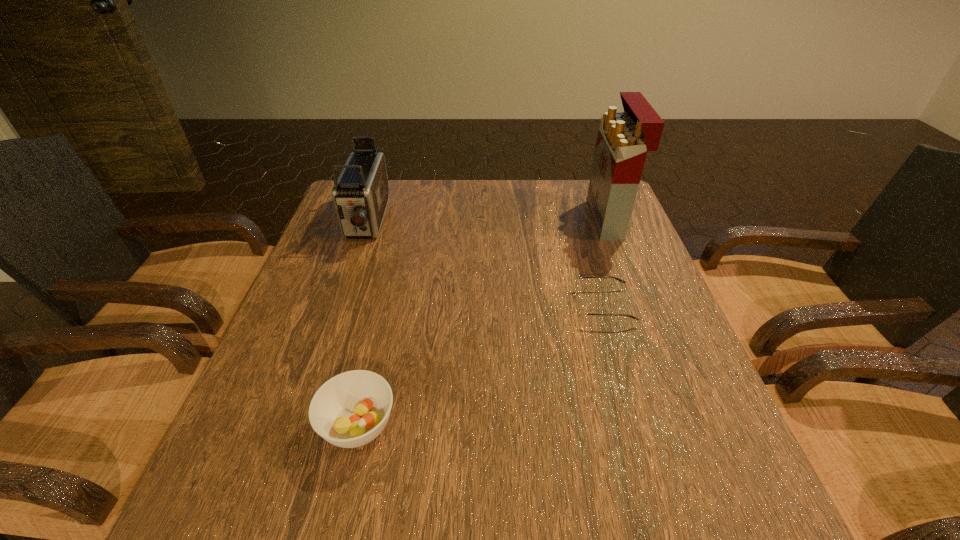
Where is `object situated at the far left corner`? This screenshot has height=540, width=960. object situated at the far left corner is located at coordinates (360, 194).

Find the location of `object positioned at the far right corner`. object positioned at the far right corner is located at coordinates (624, 138).

Find the location of a particular element. This screenshot has width=960, height=540. free space at the far edge is located at coordinates (413, 199).

Locate an element on the screen. This screenshot has height=540, width=960. free spot at the near edge of the desktop is located at coordinates (368, 506).

Locate an element on the screen. vacant space at the left edge of the desktop is located at coordinates (297, 314).

Identify the location of blank space at the right edge of the desktop. The width and height of the screenshot is (960, 540). (588, 260).

Image resolution: width=960 pixels, height=540 pixels. In order to click on vacant region at the far right corner of the desktop in this screenshot , I will do `click(567, 193)`.

Locate an element on the screen. The image size is (960, 540). free space that is in between the spectacles and the camcorder is located at coordinates pyautogui.click(x=485, y=264).

Identify the location of free spot between the tallest object and the spectacles. This screenshot has width=960, height=540. (606, 263).

Where is `free space between the cigarette case and the second tallest object`? free space between the cigarette case and the second tallest object is located at coordinates (487, 220).